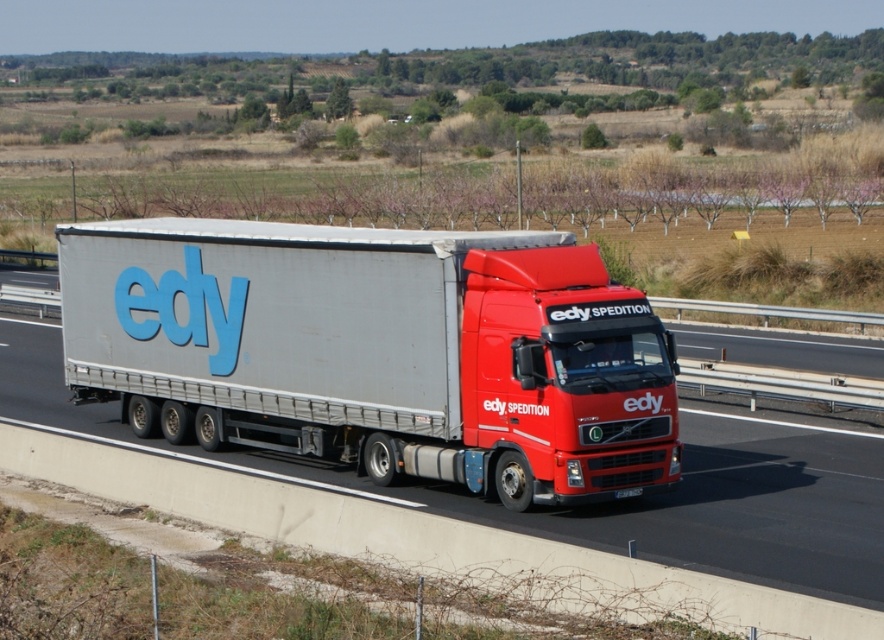
Question: Is silver metallic trailer truck at center to the left of metallic silver trailer at center from the viewer's perspective?

Choices:
 (A) no
 (B) yes

Answer: (B)

Question: Does silver metallic trailer truck at center have a larger size compared to metallic silver trailer at center?

Choices:
 (A) no
 (B) yes

Answer: (A)

Question: Does silver metallic trailer truck at center lie behind metallic silver trailer at center?

Choices:
 (A) no
 (B) yes

Answer: (B)